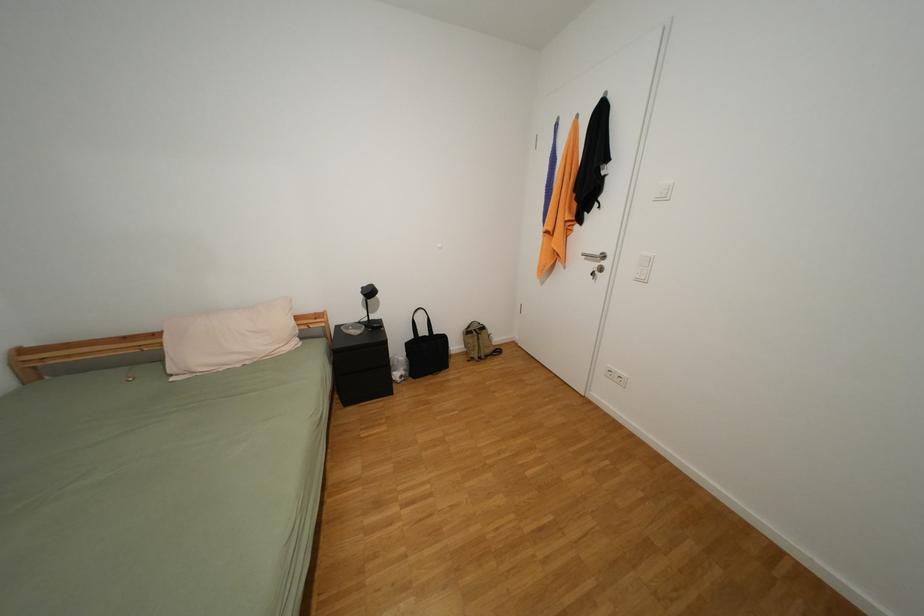
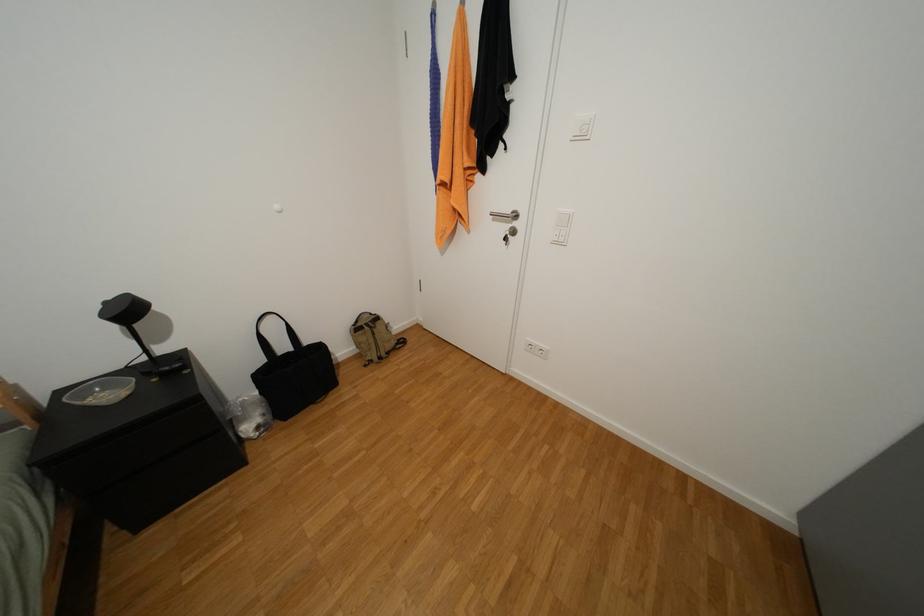
Question: The camera is either moving clockwise (left) or counter-clockwise (right) around the object. The first image is from the beginning of the video and the second image is from the end. Is the camera moving left or right when shooting the video?

Choices:
 (A) Left
 (B) Right

Answer: (A)